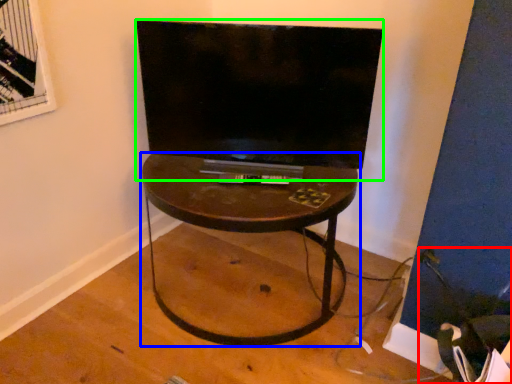
Question: Estimate the real-world distances between objects in this image. Which object is farther from swivel chair (highlighted by a red box), table (highlighted by a blue box) or television (highlighted by a green box)?

Choices:
 (A) table
 (B) television

Answer: (B)